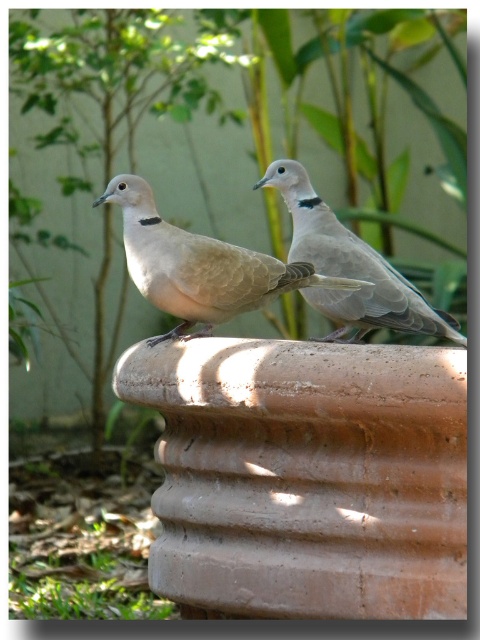
Question: Is matte beige dove at center to the left of light brown feathered dove at center from the viewer's perspective?

Choices:
 (A) no
 (B) yes

Answer: (B)

Question: Which of the following is the farthest from the observer?

Choices:
 (A) (x=252, y=269)
 (B) (x=321, y=208)

Answer: (B)

Question: Does matte beige dove at center have a greater width compared to light brown feathered dove at center?

Choices:
 (A) yes
 (B) no

Answer: (A)

Question: Does matte beige dove at center have a smaller size compared to light brown feathered dove at center?

Choices:
 (A) no
 (B) yes

Answer: (B)

Question: Which point appears closest to the camera in this image?

Choices:
 (A) (297, 224)
 (B) (333, 284)

Answer: (B)